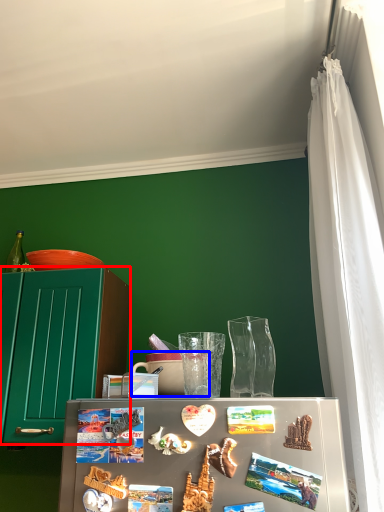
Question: Among these objects, which one is farthest to the camera, cabinetry (highlighted by a red box) or coffee cup (highlighted by a blue box)?

Choices:
 (A) cabinetry
 (B) coffee cup

Answer: (A)